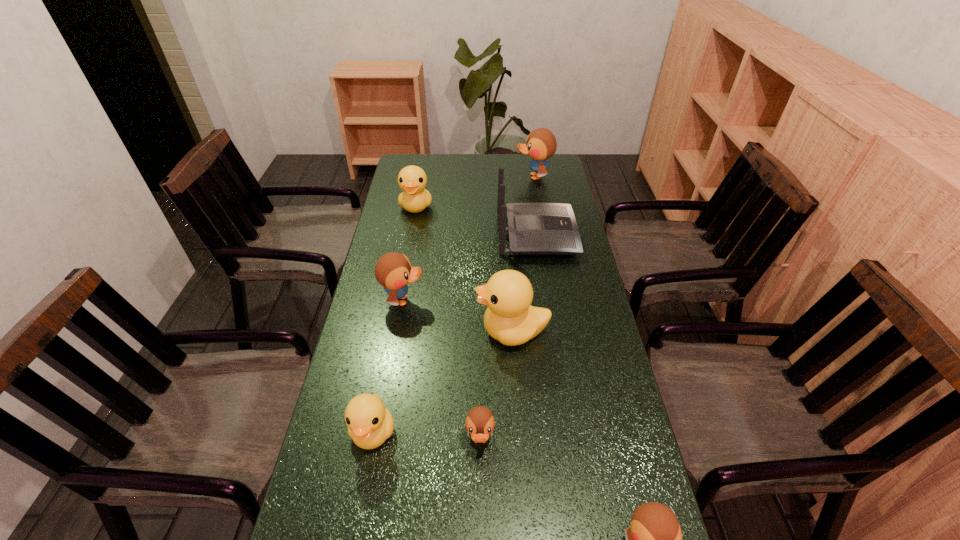
The width and height of the screenshot is (960, 540). Identify the location of the smallest blue duck. (480, 423).

Where is `the shortest duck`? the shortest duck is located at coordinates (480, 423).

Locate an element on the screen. free region located on the front-facing side of the farthest object is located at coordinates (471, 177).

Image resolution: width=960 pixels, height=540 pixels. I want to click on blank space located 0.230m on the front-facing side of the farthest object, so click(x=462, y=177).

Where is `vacant space located 0.230m on the front-facing side of the farthest object`? The width and height of the screenshot is (960, 540). vacant space located 0.230m on the front-facing side of the farthest object is located at coordinates (462, 177).

Where is `vacant area located 0.350m on the face of the biggest yellow duck`? vacant area located 0.350m on the face of the biggest yellow duck is located at coordinates (355, 331).

This screenshot has height=540, width=960. I want to click on vacant space located 0.090m on the face of the biggest yellow duck, so click(444, 331).

Locate an element on the screen. This screenshot has width=960, height=540. vacant space located 0.240m on the face of the biggest yellow duck is located at coordinates (394, 331).

Locate an element on the screen. Image resolution: width=960 pixels, height=540 pixels. vacant space located 0.130m on the face of the farthest yellow duck is located at coordinates (410, 240).

Image resolution: width=960 pixels, height=540 pixels. What are the coordinates of `free region located 0.210m on the front-facing side of the second farthest blue duck` in the screenshot? It's located at (492, 300).